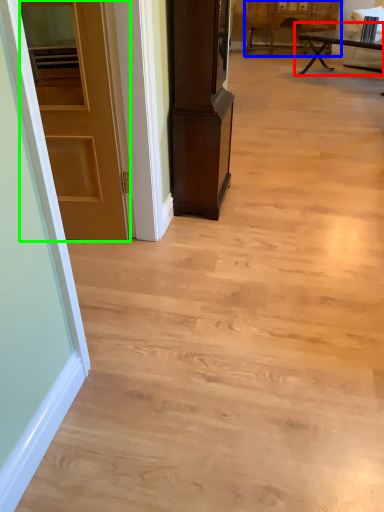
Question: Which is nearer to the table (highlighted by a red box)? cabinetry (highlighted by a blue box) or door (highlighted by a green box).

Choices:
 (A) cabinetry
 (B) door

Answer: (A)